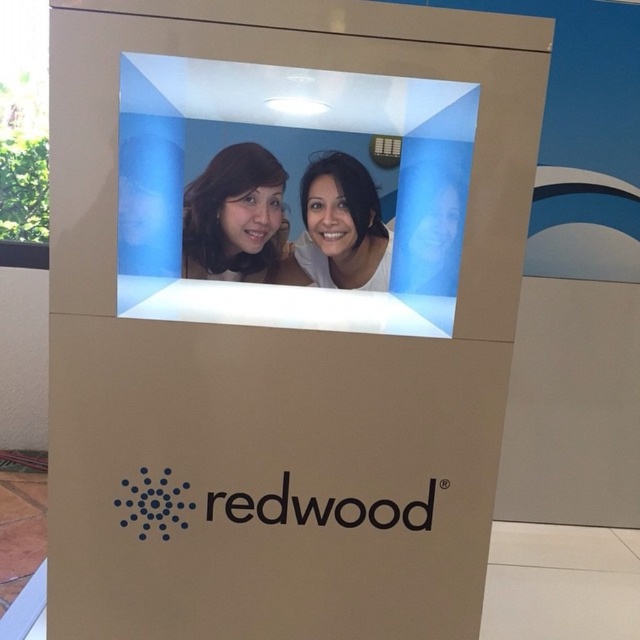
You are a photographer trying to capture the exact location of the point at coordinates point (234,216) on the promotional display. Based on the scene, where would this point be located?

The point (234,216) is located on the matte black hair at center.

You are a photographer who wants to ensure that the two subjects in the Redwood promotional display are positioned correctly. Given that the distance between the matte black hair at center and the matte white face at center is 8.24 inches, can you confirm if they are close enough to appear as a cohesive pair in the photograph?

The distance between the matte black hair at center and the matte white face at center is 8.24 inches. In photography, subjects positioned within 8 to 10 inches of each other typically appear as a cohesive pair, so yes, they are close enough.